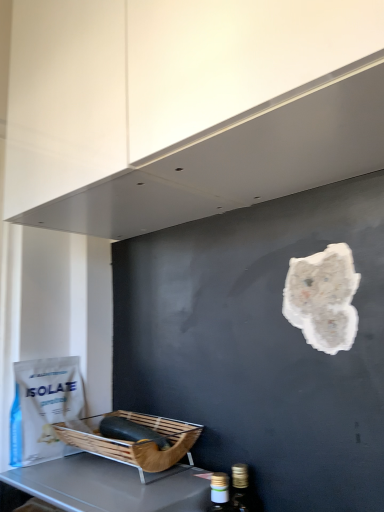
Image resolution: width=384 pixels, height=512 pixels. I want to click on free space above wooden basket at lower left (from a real-world perspective), so click(x=97, y=480).